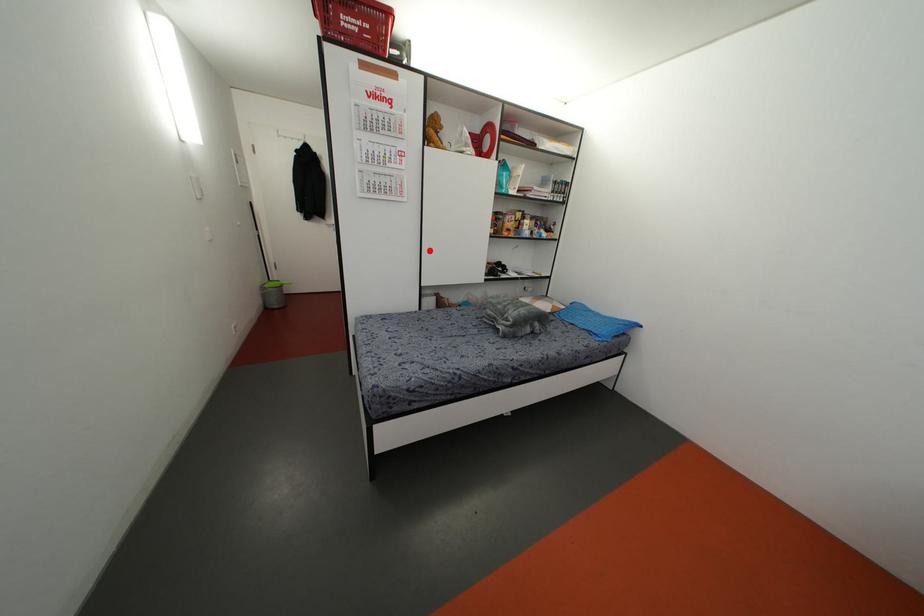
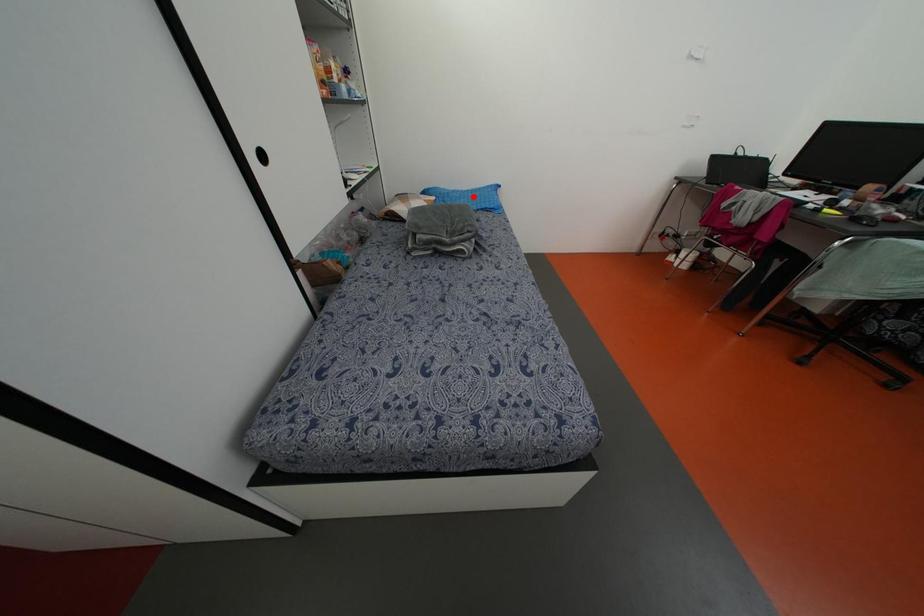
I am providing you with two images of the same scene from different viewpoints. A red point is marked on the first image and another point is marked on the second image. Is the red point in image1 aligned with the point shown in image2?

No